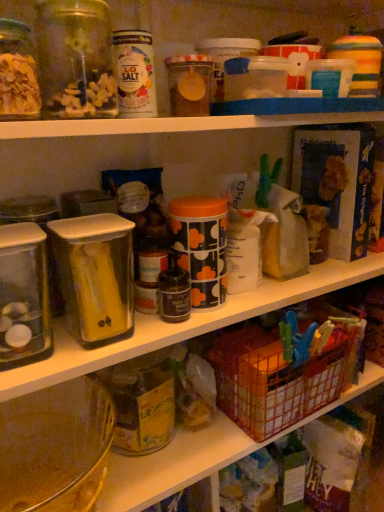
Question: Can you confirm if clear glass jar at upper left, the 2th glass jar viewed from the back, is smaller than metallic wire basket at lower right?

Choices:
 (A) yes
 (B) no

Answer: (A)

Question: Is clear glass jar at upper left, which appears as the first glass jar when viewed from the top, facing towards metallic wire basket at lower right?

Choices:
 (A) yes
 (B) no

Answer: (B)

Question: Would you say metallic wire basket at lower right is part of clear glass jar at upper left, which appears as the first glass jar when viewed from the top,'s contents?

Choices:
 (A) no
 (B) yes

Answer: (A)

Question: Is there a large distance between clear glass jar at upper left, the 2th glass jar viewed from the back, and metallic wire basket at lower right?

Choices:
 (A) yes
 (B) no

Answer: (B)

Question: From a real-world perspective, is clear glass jar at upper left, which appears as the first glass jar when viewed from the top, below metallic wire basket at lower right?

Choices:
 (A) no
 (B) yes

Answer: (A)

Question: Is clear glass jar at upper left, the 2th glass jar viewed from the back, spatially inside translucent glass jar at lower center, which is the first glass jar from back to front, or outside of it?

Choices:
 (A) outside
 (B) inside

Answer: (A)

Question: In terms of size, does clear glass jar at upper left, which appears as the first glass jar when viewed from the top, appear bigger or smaller than translucent glass jar at lower center, which is counted as the second glass jar, starting from the front?

Choices:
 (A) big
 (B) small

Answer: (B)

Question: Is clear glass jar at upper left, the 2th glass jar viewed from the back, wider or thinner than translucent glass jar at lower center, which is counted as the second glass jar, starting from the front?

Choices:
 (A) wide
 (B) thin

Answer: (B)

Question: From a real-world perspective, is clear glass jar at upper left, marked as the second glass jar in a bottom-to-top arrangement, positioned above or below translucent glass jar at lower center, which is the first glass jar from back to front?

Choices:
 (A) above
 (B) below

Answer: (A)

Question: Looking at their shapes, would you say translucent glass jar at lower center, which is counted as the second glass jar, starting from the front, is wider or thinner than clear plastic canister at center-left?

Choices:
 (A) wide
 (B) thin

Answer: (A)

Question: From a real-world perspective, is translucent glass jar at lower center, which is the 1th glass jar from bottom to top, above or below clear plastic canister at center-left?

Choices:
 (A) above
 (B) below

Answer: (B)

Question: In the image, is translucent glass jar at lower center, which is counted as the second glass jar, starting from the front, positioned in front of or behind clear plastic canister at center-left?

Choices:
 (A) front
 (B) behind

Answer: (B)

Question: Would you say translucent glass jar at lower center, which is the 1th glass jar from bottom to top, is to the left or to the right of clear plastic canister at center-left in the picture?

Choices:
 (A) left
 (B) right

Answer: (B)

Question: From a real-world perspective, is metallic wire basket at lower right physically located above or below translucent glass jar at lower center, the second glass jar from the top?

Choices:
 (A) below
 (B) above

Answer: (A)

Question: Based on their sizes in the image, would you say metallic wire basket at lower right is bigger or smaller than translucent glass jar at lower center, which is the first glass jar from back to front?

Choices:
 (A) big
 (B) small

Answer: (A)